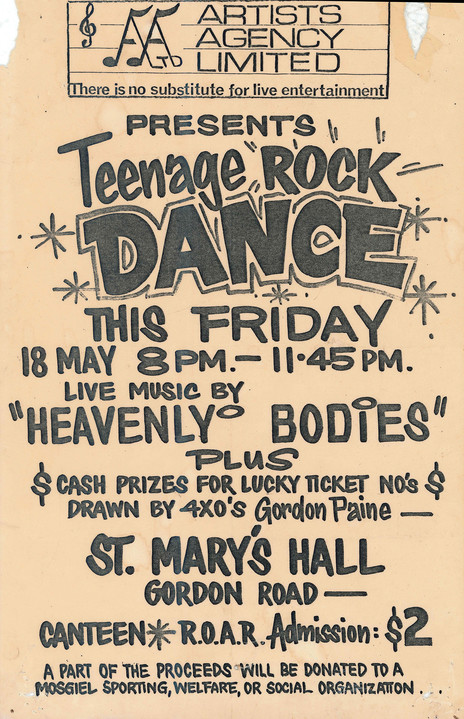
Where is `rip in upper left side of poster`? The height and width of the screenshot is (719, 464). rip in upper left side of poster is located at coordinates (14, 32).